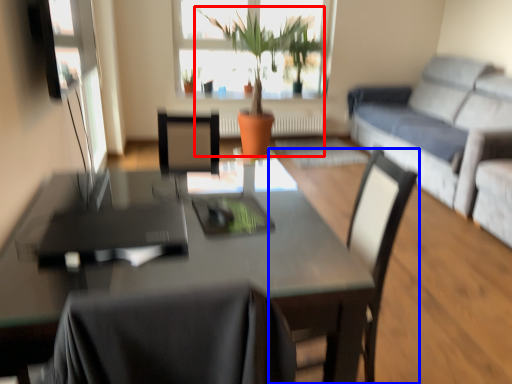
Question: Which object appears farthest to the camera in this image, houseplant (highlighted by a red box) or chair (highlighted by a blue box)?

Choices:
 (A) houseplant
 (B) chair

Answer: (A)